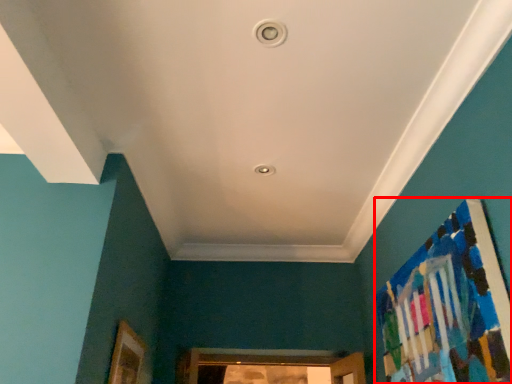
Question: From the image's perspective, what is the correct spatial positioning of bulletin board (annotated by the red box) in reference to picture frame?

Choices:
 (A) above
 (B) below

Answer: (A)